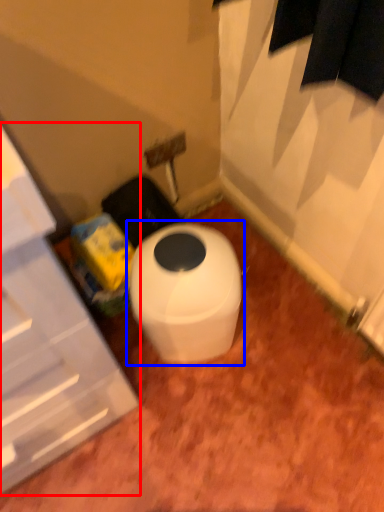
Question: Which object is closer to the camera taking this photo, cabinetry (highlighted by a red box) or toilet (highlighted by a blue box)?

Choices:
 (A) cabinetry
 (B) toilet

Answer: (A)